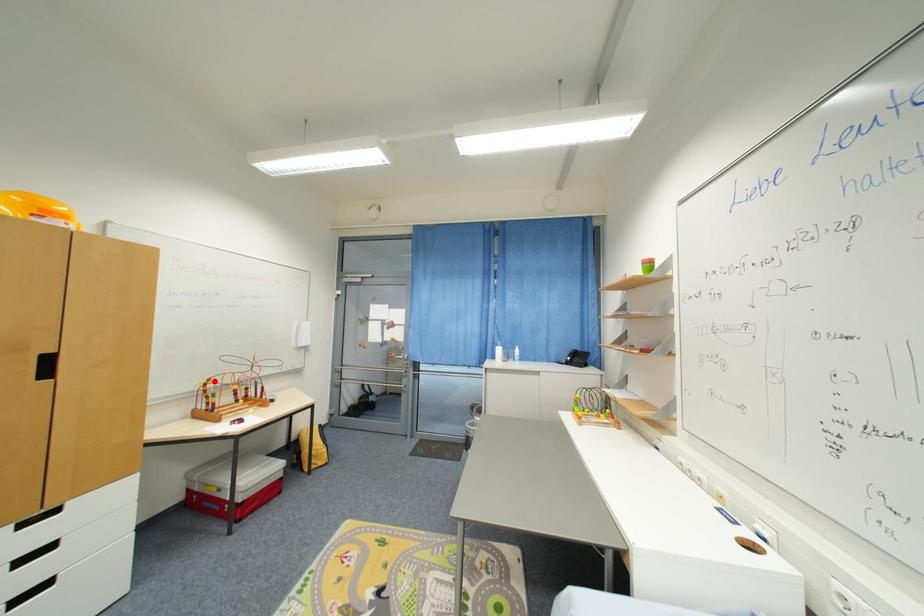
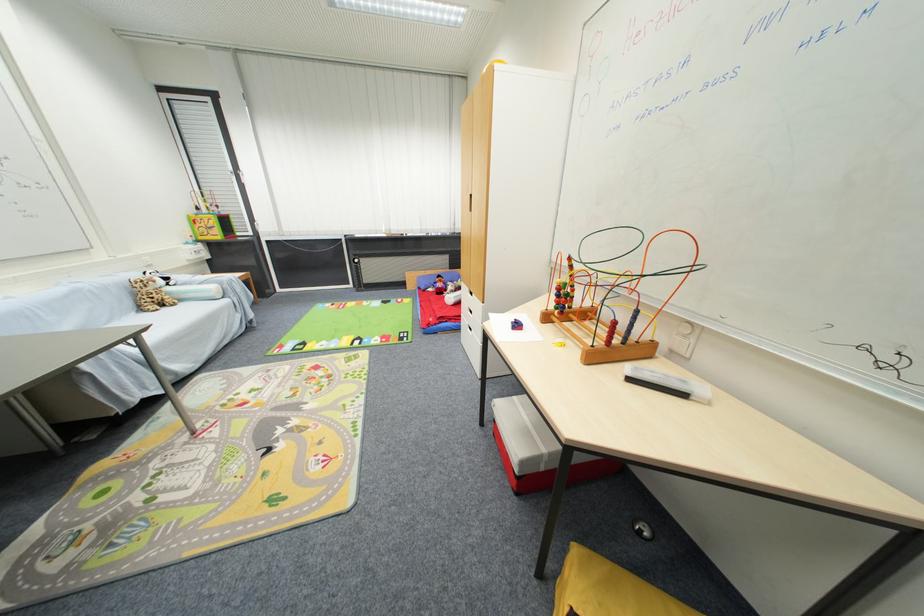
Where in the second image is the point corresponding to the highlighted location from the first image?

(575, 261)